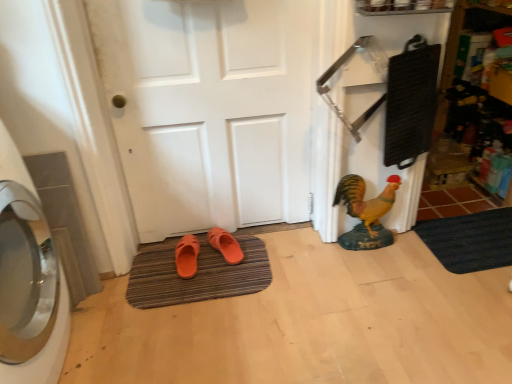
The image size is (512, 384). I want to click on spots to the right of brown striped bath mat at center, the first bath mat viewed from the left, so tap(310, 294).